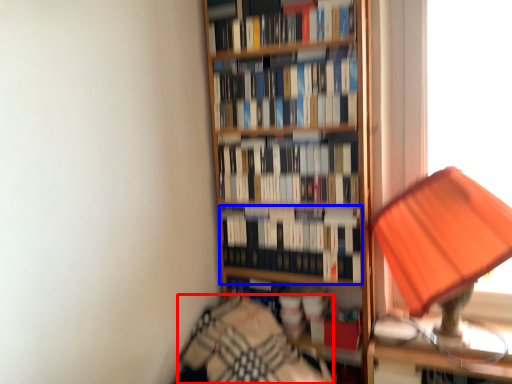
Question: Among these objects, which one is nearest to the camera, bedding (highlighted by a red box) or book (highlighted by a blue box)?

Choices:
 (A) bedding
 (B) book

Answer: (A)